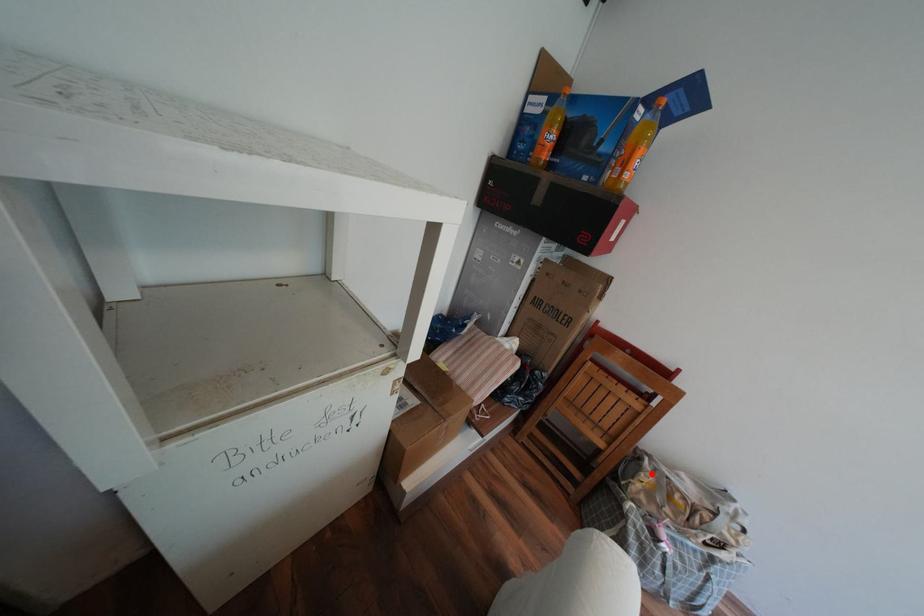
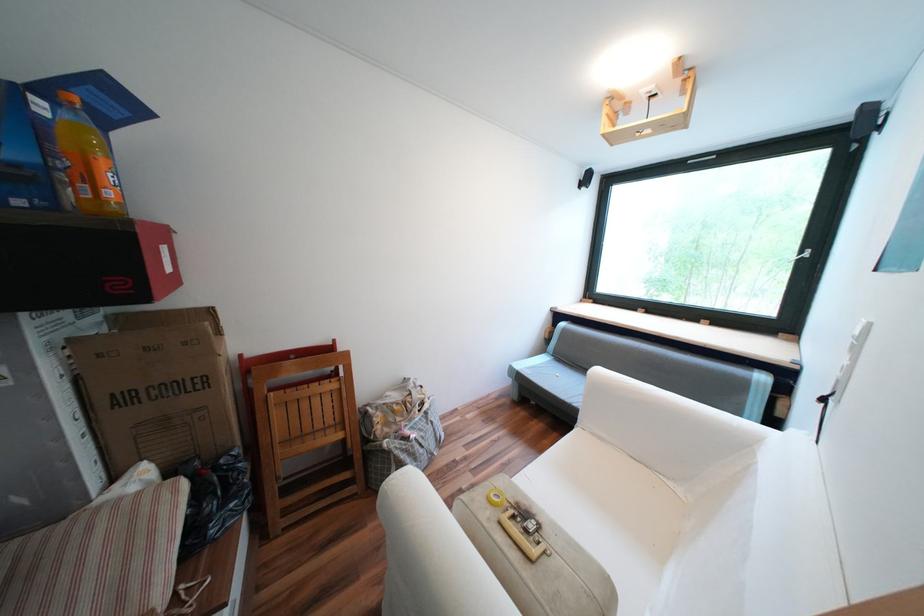
In the second image, find the point that corresponds to the highlighted location in the first image.

(383, 419)